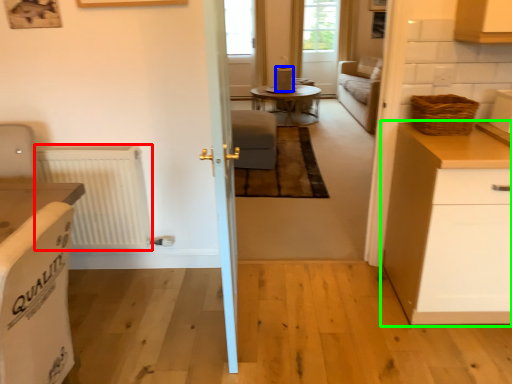
Question: Considering the real-world distances, which object is closest to radiator (highlighted by a red box)? appliance (highlighted by a blue box) or cabinetry (highlighted by a green box).

Choices:
 (A) appliance
 (B) cabinetry

Answer: (B)